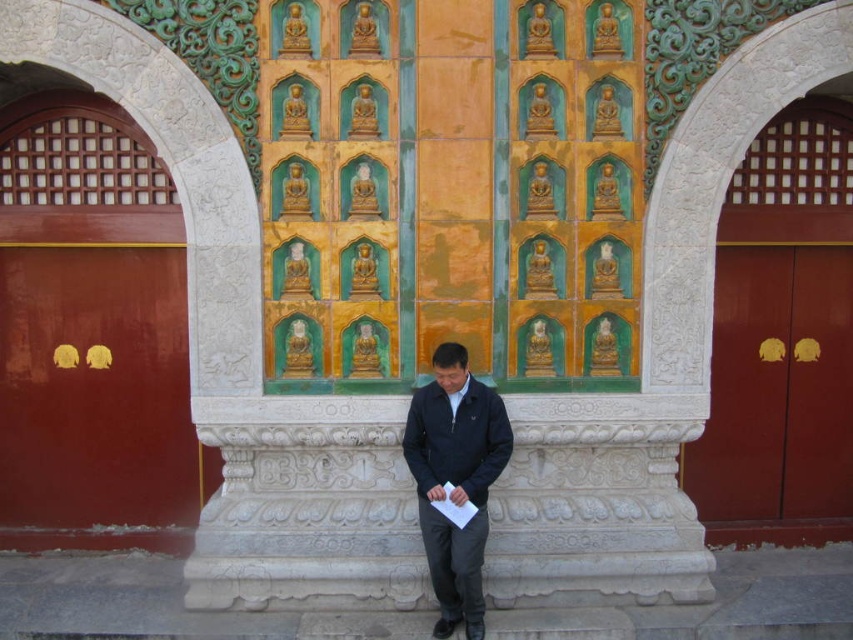
Question: Is smooth red wood door at left above matte wood door at right?

Choices:
 (A) yes
 (B) no

Answer: (B)

Question: Based on their relative distances, which object is nearer to the matte wood door at right?

Choices:
 (A) dark blue jacket at center
 (B) smooth red wood door at left

Answer: (A)

Question: Which point is closer to the camera?

Choices:
 (A) (798, 260)
 (B) (474, 538)

Answer: (B)

Question: Which of the following is the farthest from the observer?

Choices:
 (A) (799, 424)
 (B) (465, 420)
 (C) (61, 528)

Answer: (A)

Question: Is smooth red wood door at left to the left of dark blue jacket at center from the viewer's perspective?

Choices:
 (A) yes
 (B) no

Answer: (A)

Question: Does smooth red wood door at left have a lesser width compared to matte wood door at right?

Choices:
 (A) yes
 (B) no

Answer: (B)